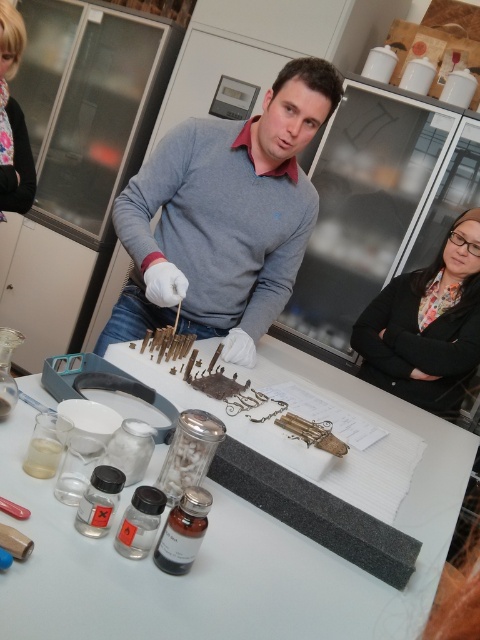
Question: Which point is farther to the camera?

Choices:
 (A) black matte table at center
 (B) floral fabric shirt at upper left

Answer: (B)

Question: Is black matte table at center below matte gray sweater at center?

Choices:
 (A) no
 (B) yes

Answer: (B)

Question: Is matte gray sweater at center above floral fabric shirt at upper left?

Choices:
 (A) yes
 (B) no

Answer: (B)

Question: Which point is closer to the camera?

Choices:
 (A) (15, 54)
 (B) (184, 582)
 (C) (463, 342)

Answer: (B)

Question: Estimate the real-world distances between objects in this image. Which object is farther from the black matte table at center?

Choices:
 (A) matte gray sweater at center
 (B) floral fabric shirt at upper left
 (C) black fabric at center

Answer: (B)

Question: Is matte gray sweater at center closer to the viewer compared to black fabric at center?

Choices:
 (A) no
 (B) yes

Answer: (B)